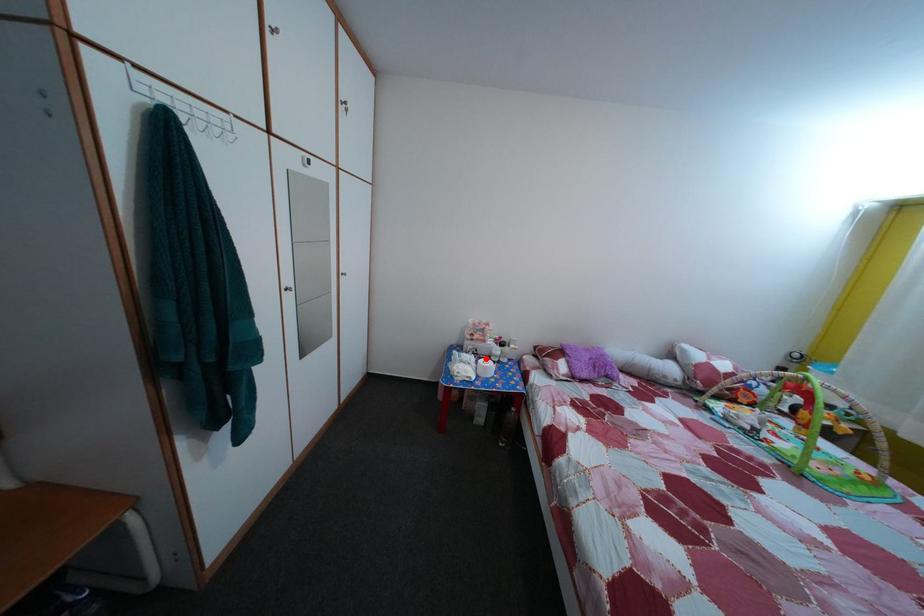
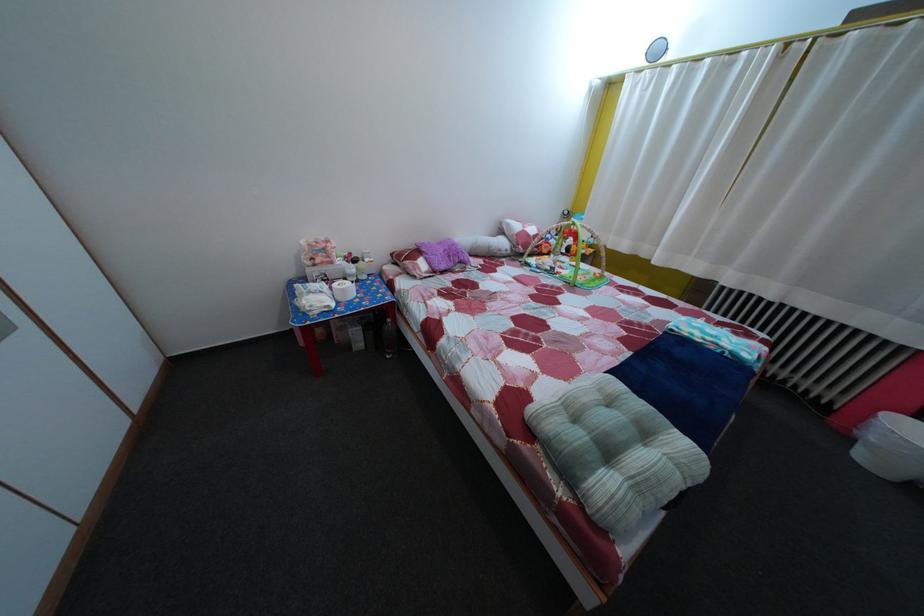
In the second image, find the point that corresponds to the highlighted location in the first image.

(335, 284)